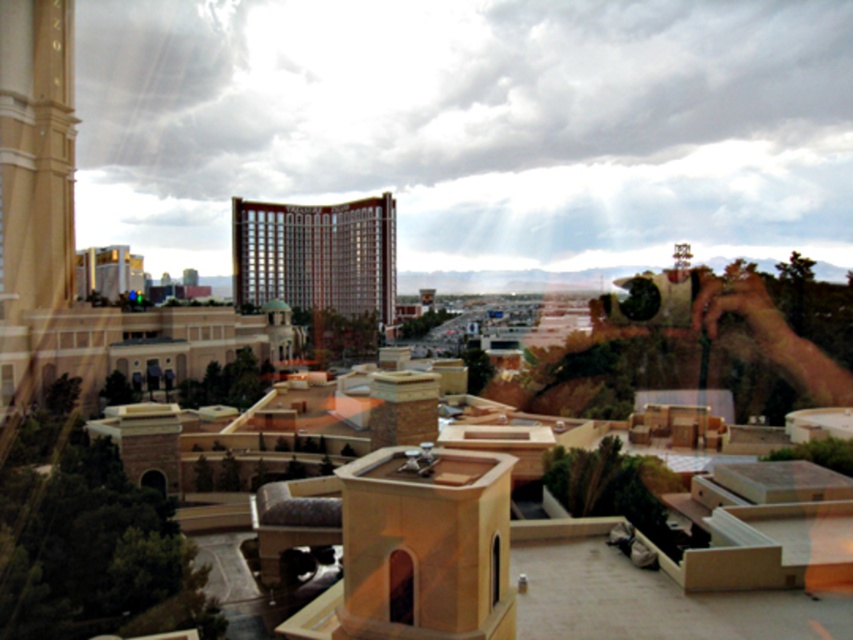
Question: Can you confirm if gold metallic hotel at center is wider than transparent glass window at upper left?

Choices:
 (A) yes
 (B) no

Answer: (A)

Question: Can you confirm if transparent glass window at center is wider than transparent glass window at upper left?

Choices:
 (A) yes
 (B) no

Answer: (B)

Question: Among these points, which one is nearest to the camera?

Choices:
 (A) (7, 376)
 (B) (491, 548)
 (C) (338, 204)

Answer: (B)

Question: Which point appears closest to the camera in this image?

Choices:
 (A) (395, 556)
 (B) (12, 372)

Answer: (A)

Question: Which object is positioned farthest from the gold metallic hotel at center?

Choices:
 (A) transparent glass window at center
 (B) matte glass window at center
 (C) transparent glass window at upper left

Answer: (A)

Question: Can you confirm if gold metallic hotel at center is wider than transparent glass window at center?

Choices:
 (A) no
 (B) yes

Answer: (B)